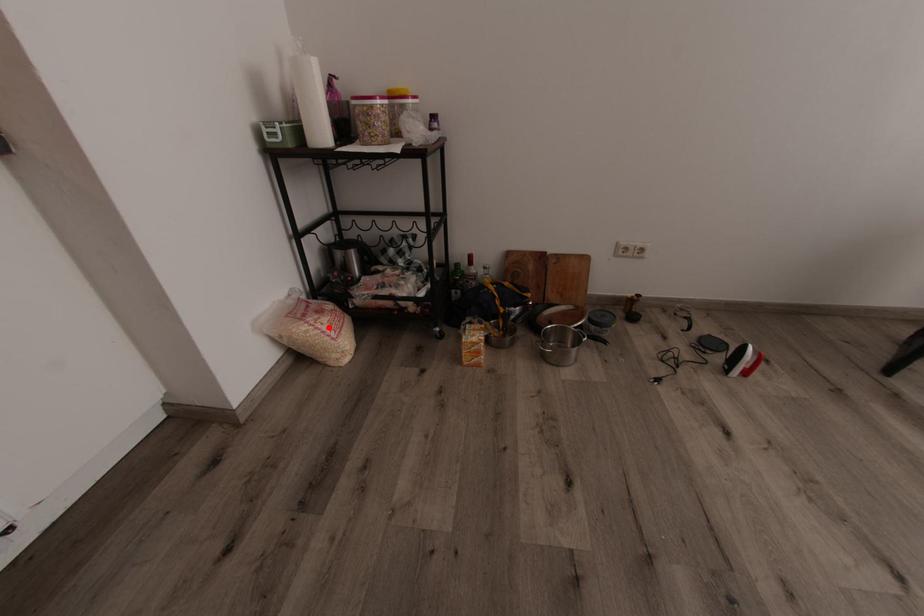
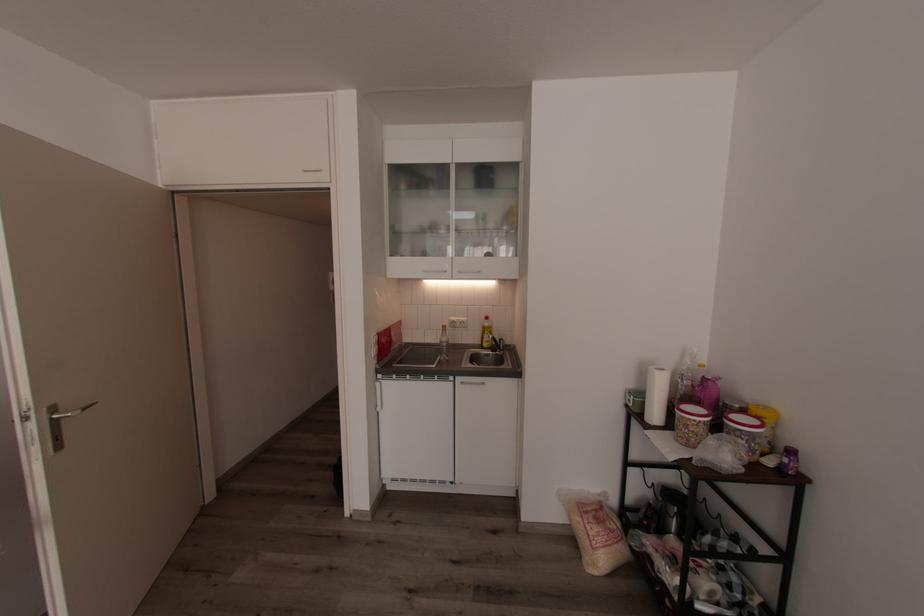
Question: A red point is marked in image1. In image2, is the corresponding 3D point closer to the camera or farther? Reply with the corresponding letter.

Choices:
 (A) The corresponding 3D point is closer.
 (B) The corresponding 3D point is farther.

Answer: (B)